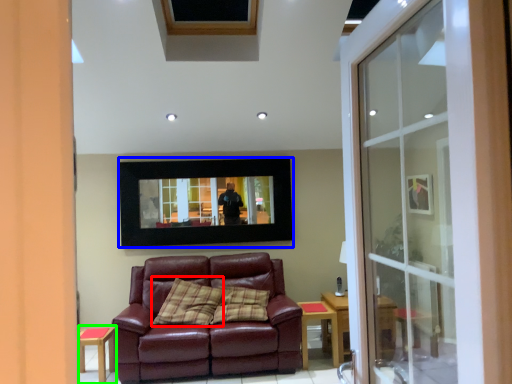
Question: Which is nearer to the pillow (highlighted by a red box)? picture frame (highlighted by a blue box) or side table (highlighted by a green box).

Choices:
 (A) picture frame
 (B) side table

Answer: (B)